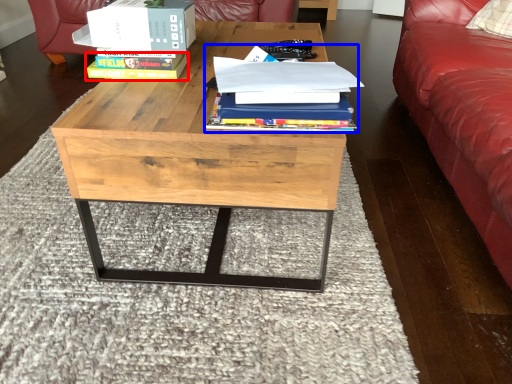
Question: Which object appears closest to the camera in this image, paperback book (highlighted by a red box) or book (highlighted by a blue box)?

Choices:
 (A) paperback book
 (B) book

Answer: (B)